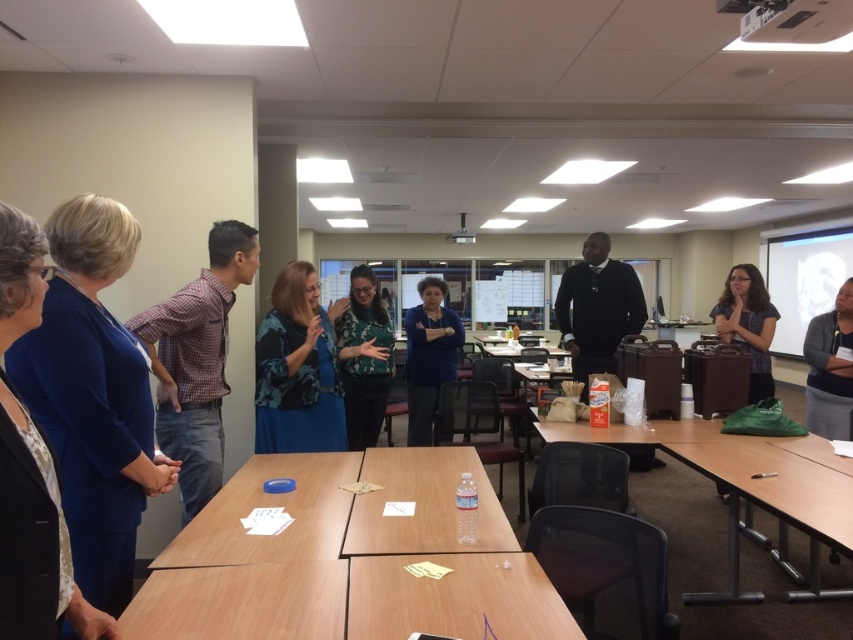
You are organizing a presentation and need to decide where to place a 12 inch wide laptop. The plaid shirt at left and the blue floral blouse at center are currently occupying space on the table. Which person should you ask to move their belongings to accommodate the laptop?

The plaid shirt at left is thinner than the blue floral blouse at center, so you should ask the person wearing the plaid shirt at left to move their belongings since they occupy less space on the table.

You are a photographer in the conference room and want to take a photo of the plaid shirt at left and the blue floral blouse at center. Which person should you focus on first if you want to capture both in the frame?

The plaid shirt at left is positioned on the left side of blue floral blouse at center, so you should focus on the plaid shirt at left first to ensure both are in the frame.